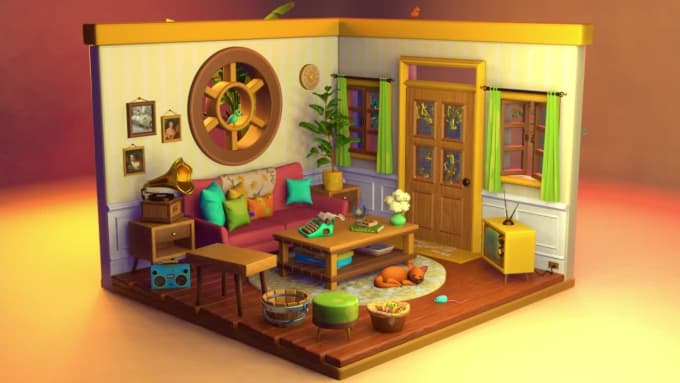
The width and height of the screenshot is (680, 383). What are the coordinates of `ottoman` in the screenshot? It's located at (326, 314).